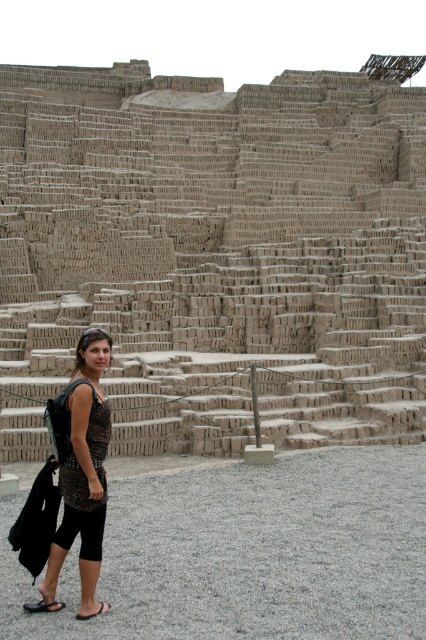
Find the location of a particular element. brown clay stairs at center is located at coordinates (218, 252).

Is leopard print dress at center below brown leather sandal at lower left?

No, leopard print dress at center is not below brown leather sandal at lower left.

What do you see at coordinates (83, 468) in the screenshot? I see `leopard print dress at center` at bounding box center [83, 468].

Who is more forward, (71, 422) or (100, 609)?

Point (100, 609)

The image size is (426, 640). I want to click on leopard print dress at center, so click(x=83, y=468).

Which is in front, point (23, 176) or point (43, 602)?

Point (43, 602) is more forward.

Does point (135, 256) come closer to viewer compared to point (37, 609)?

That is False.

Find the location of a particular element. brown clay stairs at center is located at coordinates (218, 252).